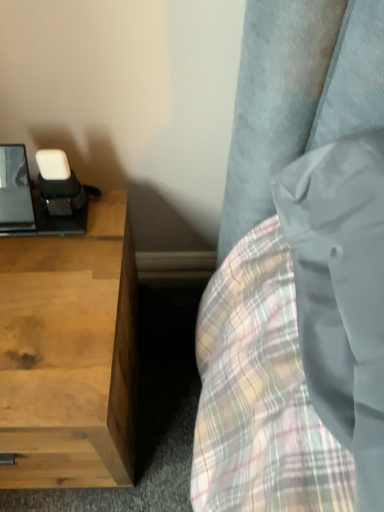
Where is `free space above light brown wood desk at left (from a real-world perspective)`? The width and height of the screenshot is (384, 512). free space above light brown wood desk at left (from a real-world perspective) is located at coordinates (50, 286).